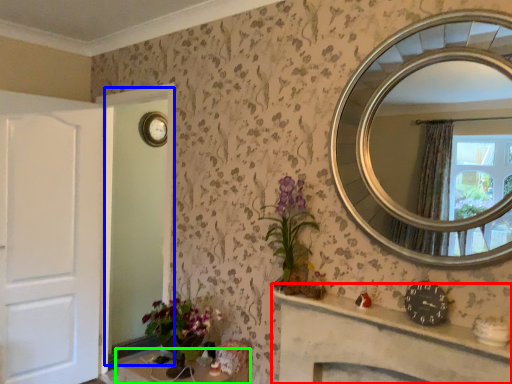
Question: Which is nearer to the vanity (highlighted by a red box)? glass door (highlighted by a blue box) or table (highlighted by a green box).

Choices:
 (A) glass door
 (B) table

Answer: (B)